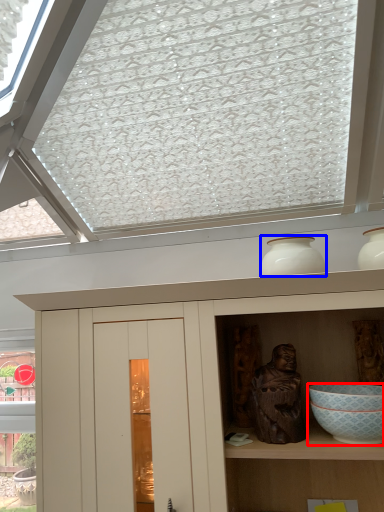
Question: Which object appears closest to the camera in this image, bowl (highlighted by a red box) or vase (highlighted by a blue box)?

Choices:
 (A) bowl
 (B) vase

Answer: (A)